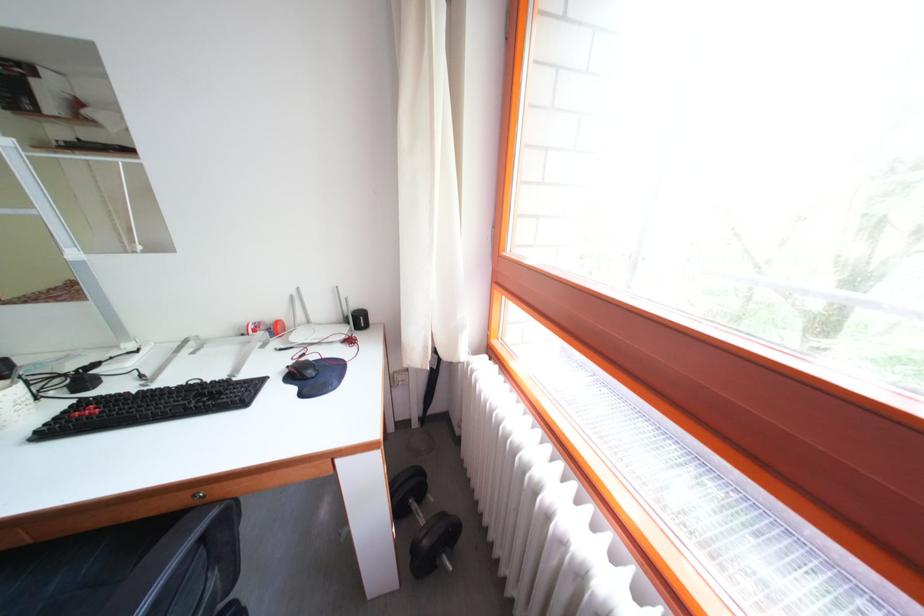
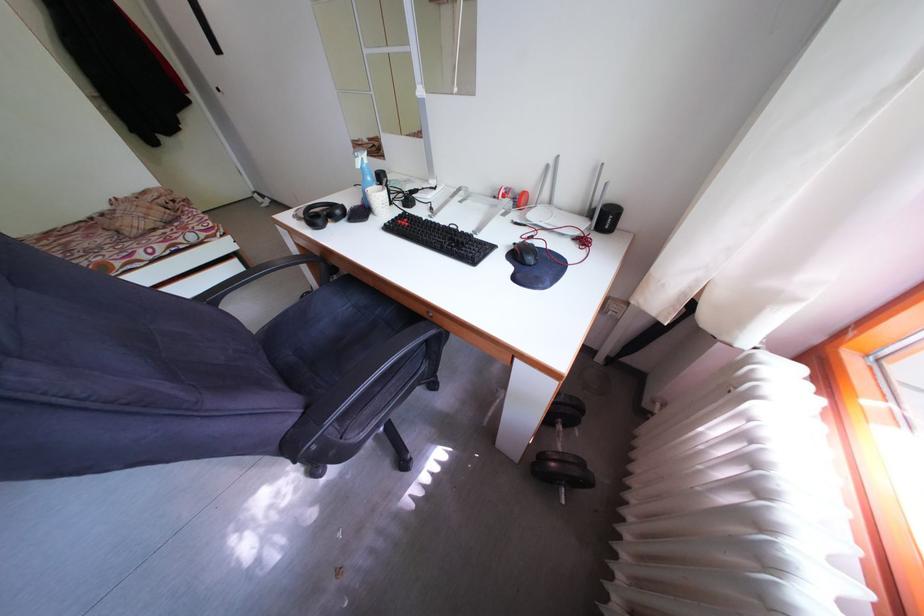
Locate, in the second image, the point that corresponds to [298,370] in the first image.

(527, 246)